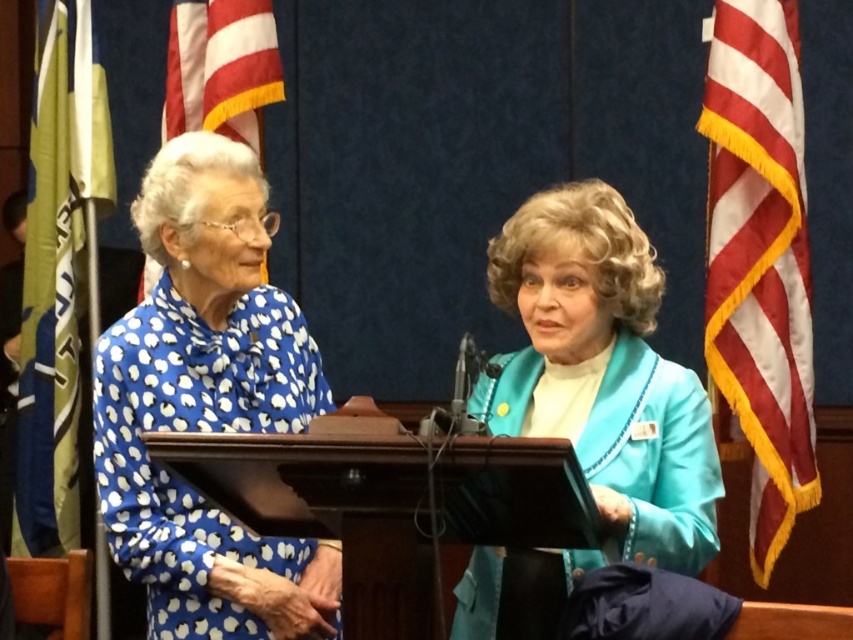
Question: Which is nearer to the yellow fabric flag at left?

Choices:
 (A) american flag at upper left
 (B) blue dotted blouse at left

Answer: (A)

Question: Does teal satin blazer at center have a larger size compared to striped fabric flag at right?

Choices:
 (A) yes
 (B) no

Answer: (A)

Question: Does blue dotted blouse at left have a larger size compared to yellow fabric flag at left?

Choices:
 (A) no
 (B) yes

Answer: (B)

Question: Observing the image, what is the correct spatial positioning of teal satin blazer at center in reference to american flag at upper left?

Choices:
 (A) below
 (B) above

Answer: (A)

Question: Which is nearer to the blue dotted blouse at left?

Choices:
 (A) teal satin blazer at center
 (B) american flag at upper left

Answer: (A)

Question: Which point appears closest to the camera in this image?

Choices:
 (A) (166, 163)
 (B) (578, 282)
 (C) (753, 356)

Answer: (B)